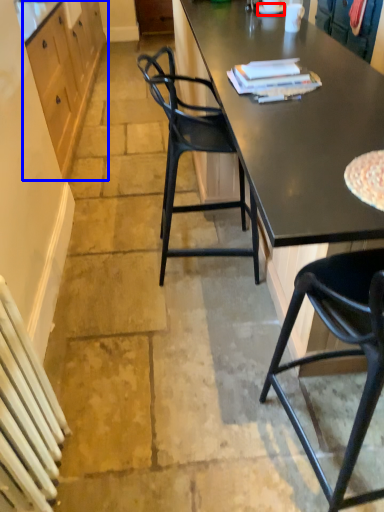
Question: Among these objects, which one is farthest to the camera, plate (highlighted by a red box) or cabinetry (highlighted by a blue box)?

Choices:
 (A) plate
 (B) cabinetry

Answer: (A)